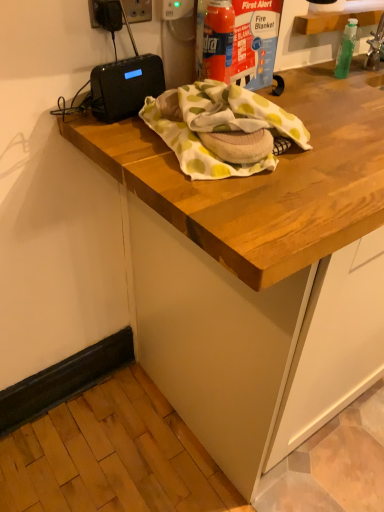
Locate an element on the screen. white plastic electric outlet at upper left is located at coordinates (138, 10).

Image resolution: width=384 pixels, height=512 pixels. What do you see at coordinates (138, 10) in the screenshot? I see `white plastic electric outlet at upper left` at bounding box center [138, 10].

What is the approximate height of white plastic electric outlet at upper left?

white plastic electric outlet at upper left is 3.64 inches in height.

You are a GUI agent. You are given a task and a screenshot of the screen. Output one action in this format:
    pyautogui.click(x=<x>, y=<y>)
    Task: Click on the white plastic electric outlet at upper left
    
    Given the screenshot: What is the action you would take?
    pyautogui.click(x=138, y=10)